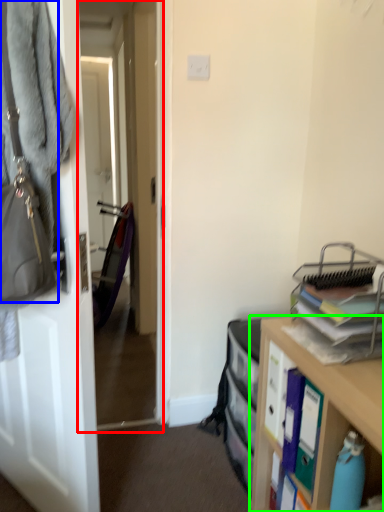
Question: Which object is positioned farthest from passage (highlighted by a red box)? Select from handbag (highlighted by a blue box) and cabinetry (highlighted by a green box).

Choices:
 (A) handbag
 (B) cabinetry

Answer: (A)